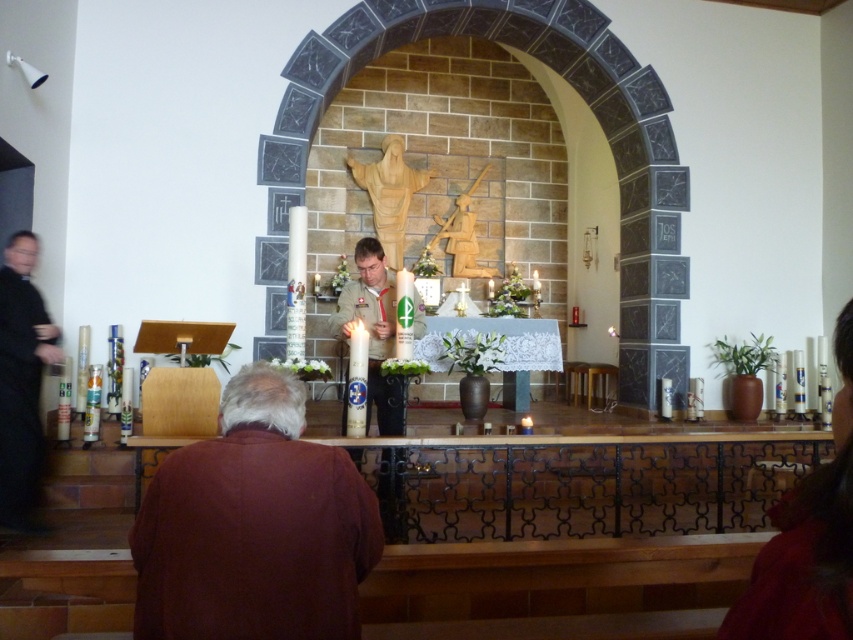
Question: Where is brown cotton shirt at lower center located in relation to black clothed figure at left in the image?

Choices:
 (A) below
 (B) above

Answer: (A)

Question: Is brown cotton shirt at lower center positioned before matte brown hair at lower right?

Choices:
 (A) yes
 (B) no

Answer: (B)

Question: Which object is the farthest from the brown cotton shirt at lower center?

Choices:
 (A) smooth white candle at center
 (B) black clothed figure at left
 (C) matte brown hair at lower right

Answer: (B)

Question: Which object is positioned farthest from the matte brown hair at lower right?

Choices:
 (A) black clothed figure at left
 (B) smooth white candle at center

Answer: (A)

Question: Is brown cotton shirt at lower center smaller than smooth white candle at center?

Choices:
 (A) no
 (B) yes

Answer: (B)

Question: Which point appears closest to the camera in this image?

Choices:
 (A) (283, 410)
 (B) (28, 289)
 (C) (351, 320)

Answer: (A)